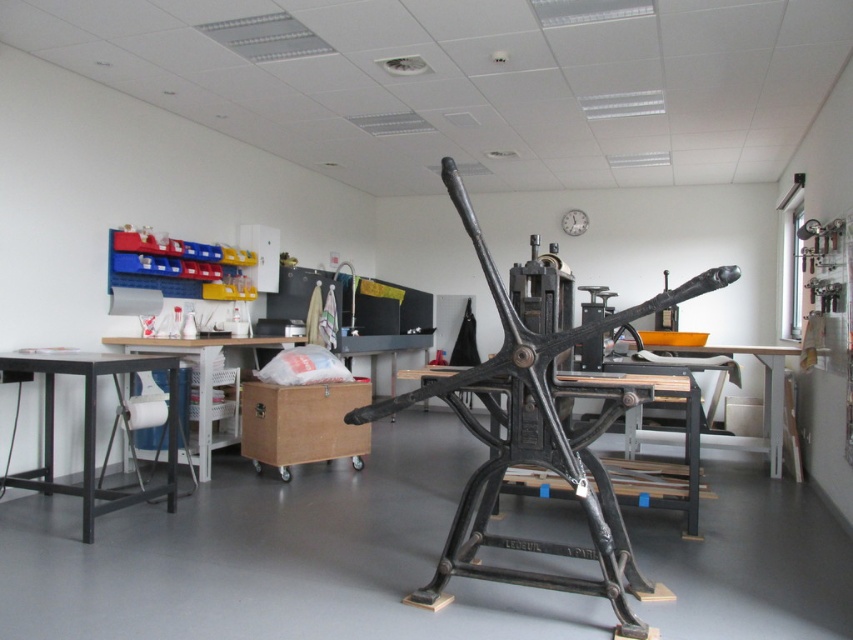
You are a student in the workshop and need to place a stack of paper on the taller table. Which table should you choose between the black metal table at center and the white plastic table at left?

The white plastic table at left is taller than the black metal table at center, so you should choose the white plastic table at left.

What is located at the point with coordinates (535, 442) in the image?

The black cast iron press at center is located at the point with coordinates (535, 442).

You need to place a large poster on a surface in the workshop. Which object between the black cast iron press at center and the white plastic table at left would be more suitable for placing the poster?

The black cast iron press at center has a larger size compared to the white plastic table at left, so it would provide a more stable and spacious surface for placing the large poster.